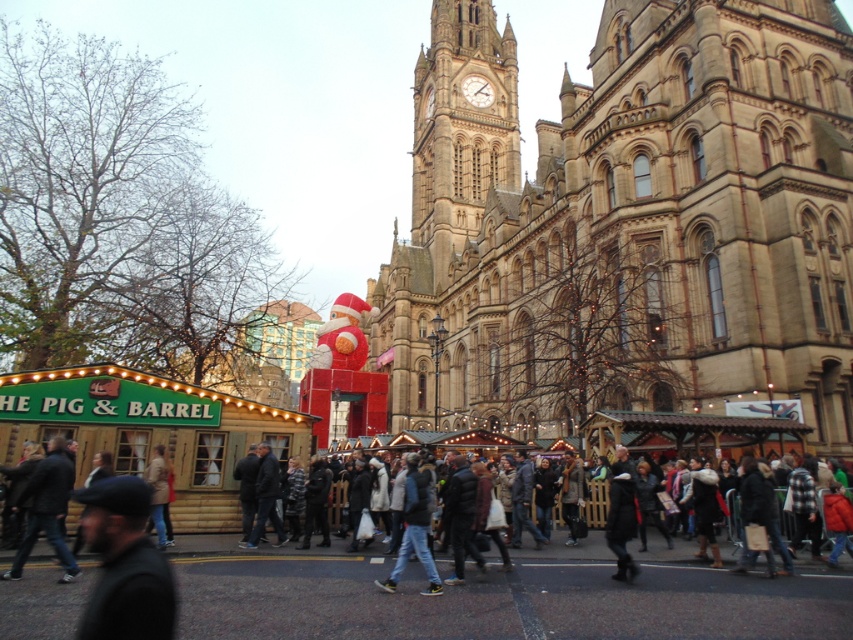
Question: Which object is farther from the camera taking this photo?

Choices:
 (A) dark gray jacket at lower left
 (B) dark gray clothing at center
 (C) beige stone cathedral at upper center

Answer: (C)

Question: Which of the following is the closest to the observer?

Choices:
 (A) (409, 282)
 (B) (424, 561)
 (C) (161, 468)
 (D) (625, 481)

Answer: (B)

Question: Does dark gray jacket at lower left have a lesser width compared to light brown leather jacket at lower left?

Choices:
 (A) yes
 (B) no

Answer: (B)

Question: Considering the real-world distances, which object is closest to the beige stone cathedral at upper center?

Choices:
 (A) jeans at center
 (B) dark gray clothing at center
 (C) light brown leather jacket at lower left
 (D) dark gray jacket at lower left

Answer: (B)

Question: Can you confirm if beige stone cathedral at upper center is positioned to the left of light brown leather jacket at lower left?

Choices:
 (A) no
 (B) yes

Answer: (A)

Question: Is beige stone cathedral at upper center positioned in front of jeans at center?

Choices:
 (A) yes
 (B) no

Answer: (B)